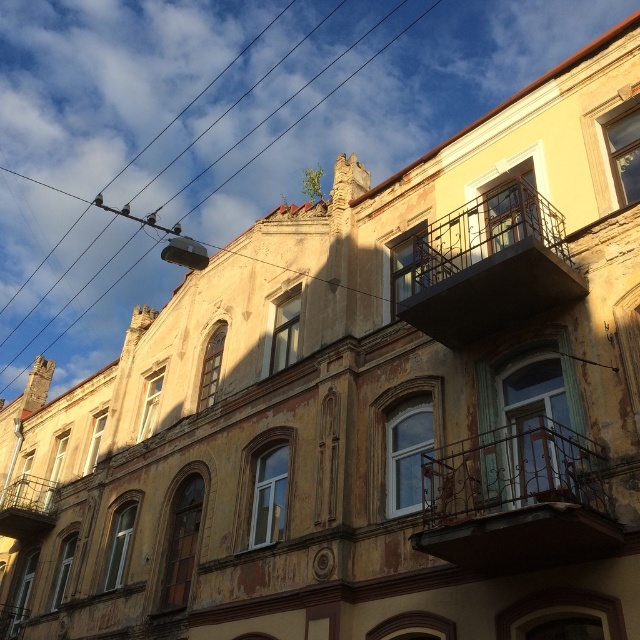
Question: Among these points, which one is nearest to the camera?

Choices:
 (A) (586, 541)
 (B) (108, 285)

Answer: (A)

Question: Is iron/ornate balcony at center smaller than black metal balcony at upper right?

Choices:
 (A) yes
 (B) no

Answer: (A)

Question: Considering the real-world distances, which object is farthest from the metallic wire at upper center?

Choices:
 (A) black metal balcony at upper right
 (B) rusty metal balcony at lower left

Answer: (A)

Question: Is metallic wire at upper center positioned before rusty metal balcony at lower left?

Choices:
 (A) yes
 (B) no

Answer: (B)

Question: Which of these objects is positioned farthest from the black metal balcony at upper right?

Choices:
 (A) iron/ornate balcony at center
 (B) rusty metal balcony at lower left

Answer: (B)

Question: Can you confirm if black metal balcony at upper right is positioned to the left of metallic wire at upper center?

Choices:
 (A) yes
 (B) no

Answer: (B)